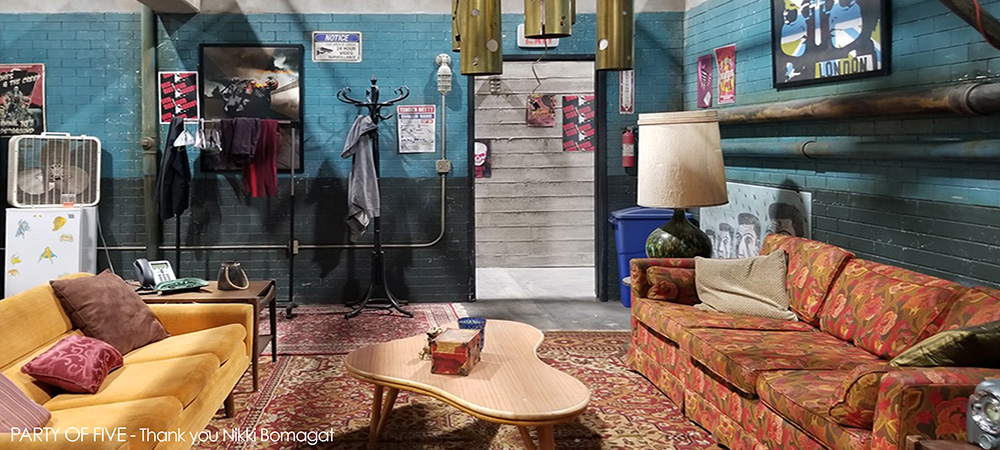
Image resolution: width=1000 pixels, height=450 pixels. Find the location of `blue brick wall`. blue brick wall is located at coordinates 391,54, 70,58, 654,59.